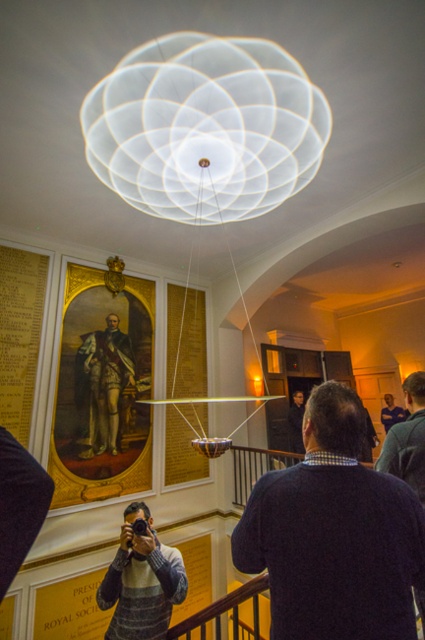
You are a fashion designer observing an event where two individuals are standing at the center of a room with historical decor. You notice the striped sweater at center and the gold textured uniform at center. Which clothing item is wider?

The striped sweater at center is wider than the gold textured uniform at center according to the description provided.

You are an event planner organizing a photoshoot in this room. You need to decide which of the two items, the striped sweater at center or the gold textured uniform at center, will look better in a full body shot since the camera is positioned at eye level. Which one should you choose and why?

The gold textured uniform at center has a greater height compared to the striped sweater at center, so it will look better in a full body shot as it will be more visible and proportionate when captured from eye level.